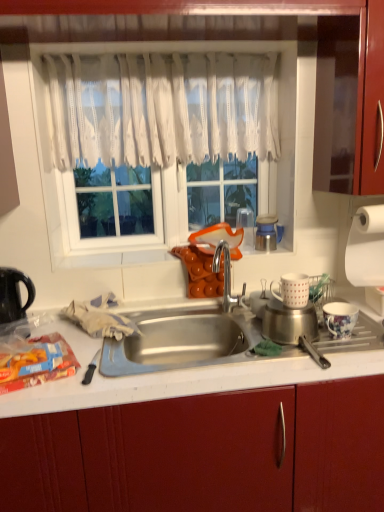
What do you see at coordinates (110, 259) in the screenshot? I see `orange matte cups at center` at bounding box center [110, 259].

Measure the distance between transparent plastic cup at upper center, the fifth appliance positioned from the right, and camera.

transparent plastic cup at upper center, the fifth appliance positioned from the right, is 1.92 meters from camera.

In order to face transparent plastic cup at upper center, the first appliance positioned from the left, should I rotate leftwards or rightwards?

Turn right by 7.497 degrees to look at transparent plastic cup at upper center, the first appliance positioned from the left.

Locate an element on the screen. This screenshot has height=512, width=384. black plastic kettle at left is located at coordinates (14, 294).

The image size is (384, 512). Describe the element at coordinates (340, 318) in the screenshot. I see `porcelain floral cup at right, marked as the second appliance in a right-to-left arrangement` at that location.

Find the location of a particular element. The height and width of the screenshot is (512, 384). white paper towel at upper right, arranged as the fifth appliance when viewed from the left is located at coordinates (367, 254).

In the scene shown: In order to face white lace curtain at upper center, should I rotate leftwards or rightwards?

You should look left and rotate roughly 3.071 degrees.

At what (x,y) coordinates should I click in order to perform the action: click on orange matte cups at center. Please return your answer as a coordinate pair (x, y). The image size is (384, 512). Looking at the image, I should click on (x=110, y=259).

From the picture: Between orange matte cups at center and white lace curtain at upper center, which one has smaller size?

With smaller size is orange matte cups at center.

Is orange matte cups at center to the left of white lace curtain at upper center from the viewer's perspective?

In fact, orange matte cups at center is to the right of white lace curtain at upper center.

Who is more distant, orange matte cups at center or white lace curtain at upper center?

orange matte cups at center is further from the camera.

From a real-world perspective, between orange matte cups at center and white lace curtain at upper center, who is vertically higher?

white lace curtain at upper center.

In terms of width, does transparent plastic cup at upper center, the fifth appliance positioned from the right, look wider or thinner when compared to white paper towel at upper right, arranged as the fifth appliance when viewed from the left?

transparent plastic cup at upper center, the fifth appliance positioned from the right, is thinner than white paper towel at upper right, arranged as the fifth appliance when viewed from the left.

Is point (252, 219) in front of point (380, 274)?

No, (252, 219) is further to viewer.

Considering the sizes of transparent plastic cup at upper center, the fifth appliance positioned from the right, and white paper towel at upper right, arranged as the fifth appliance when viewed from the left, in the image, is transparent plastic cup at upper center, the fifth appliance positioned from the right, taller or shorter than white paper towel at upper right, arranged as the fifth appliance when viewed from the left,?

In the image, transparent plastic cup at upper center, the fifth appliance positioned from the right, appears to be shorter than white paper towel at upper right, arranged as the fifth appliance when viewed from the left.

From the image's perspective, does transparent plastic cup at upper center, the fifth appliance positioned from the right, appear lower than white paper towel at upper right, arranged as the fifth appliance when viewed from the left?

Actually, transparent plastic cup at upper center, the fifth appliance positioned from the right, appears above white paper towel at upper right, arranged as the fifth appliance when viewed from the left, in the image.

How much distance is there between white paper towel at upper right, acting as the 1th appliance starting from the right, and transparent plastic cup at upper center, the first appliance positioned from the left?

19.55 inches.

Which object is closer to the camera, white paper towel at upper right, acting as the 1th appliance starting from the right, or transparent plastic cup at upper center, the first appliance positioned from the left?

Positioned in front is white paper towel at upper right, acting as the 1th appliance starting from the right.

In the scene shown: From a real-world perspective, between white paper towel at upper right, arranged as the fifth appliance when viewed from the left, and transparent plastic cup at upper center, the fifth appliance positioned from the right, who is vertically lower?

white paper towel at upper right, arranged as the fifth appliance when viewed from the left, is physically lower.

From the image's perspective, is white paper towel at upper right, arranged as the fifth appliance when viewed from the left, beneath transparent plastic cup at upper center, the fifth appliance positioned from the right?

Correct, white paper towel at upper right, arranged as the fifth appliance when viewed from the left, appears lower than transparent plastic cup at upper center, the fifth appliance positioned from the right, in the image.

From the image's perspective, which one is positioned higher, white paper towel at upper right, acting as the 1th appliance starting from the right, or white lace curtain at upper center?

white lace curtain at upper center is shown above in the image.

Considering the relative sizes of white paper towel at upper right, acting as the 1th appliance starting from the right, and white lace curtain at upper center in the image provided, is white paper towel at upper right, acting as the 1th appliance starting from the right, bigger than white lace curtain at upper center?

No, white paper towel at upper right, acting as the 1th appliance starting from the right, is not bigger than white lace curtain at upper center.

Considering the positions of objects white paper towel at upper right, arranged as the fifth appliance when viewed from the left, and white lace curtain at upper center in the image provided, who is more to the left, white paper towel at upper right, arranged as the fifth appliance when viewed from the left, or white lace curtain at upper center?

white lace curtain at upper center.

Is there a large distance between white matte mug at right, which is the fourth appliance from right to left, and white lace curtain at upper center?

That's not correct — white matte mug at right, which is the fourth appliance from right to left, is a little close to white lace curtain at upper center.

Is white matte mug at right, the second appliance in the left-to-right sequence, thinner than white lace curtain at upper center?

No.

Can you confirm if white matte mug at right, the second appliance in the left-to-right sequence, is positioned to the left of white lace curtain at upper center?

No.

From the image's perspective, is white matte mug at right, the second appliance in the left-to-right sequence, over white lace curtain at upper center?

No, from the image's perspective, white matte mug at right, the second appliance in the left-to-right sequence, is not above white lace curtain at upper center.

Would you consider black plastic kettle at left to be distant from metallic blue thermos at upper right, which is the 3th appliance in right-to-left order?

black plastic kettle at left is far away from metallic blue thermos at upper right, which is the 3th appliance in right-to-left order.

In the scene shown: From the image's perspective, is black plastic kettle at left located above metallic blue thermos at upper right, the third appliance when ordered from left to right?

No, from the image's perspective, black plastic kettle at left is not above metallic blue thermos at upper right, the third appliance when ordered from left to right.

Is black plastic kettle at left wider or thinner than metallic blue thermos at upper right, which is the 3th appliance in right-to-left order?

Clearly, black plastic kettle at left has more width compared to metallic blue thermos at upper right, which is the 3th appliance in right-to-left order.

In the image, there is a metallic blue thermos at upper right, which is the 3th appliance in right-to-left order. In order to click on kitchen appliance below it (from a real-world perspective) in this screenshot , I will do `click(14, 294)`.

Does metallic blue thermos at upper right, the third appliance when ordered from left to right, come in front of white matte mug at right, which is the fourth appliance from right to left?

That is False.

From the image's perspective, would you say metallic blue thermos at upper right, which is the 3th appliance in right-to-left order, is shown under white matte mug at right, which is the fourth appliance from right to left?

Actually, metallic blue thermos at upper right, which is the 3th appliance in right-to-left order, appears above white matte mug at right, which is the fourth appliance from right to left, in the image.

In terms of height, does metallic blue thermos at upper right, the third appliance when ordered from left to right, look taller or shorter compared to white matte mug at right, the second appliance in the left-to-right sequence?

In the image, metallic blue thermos at upper right, the third appliance when ordered from left to right, appears to be taller than white matte mug at right, the second appliance in the left-to-right sequence.

Find the location of a particular element. curtain that appears in front of the orange matte cups at center is located at coordinates (162, 108).

The width and height of the screenshot is (384, 512). Identify the location of the 1st appliance behind the white paper towel at upper right, arranged as the fifth appliance when viewed from the left. (246, 226).

Estimate the real-world distances between objects in this image. Which object is further from white lace curtain at upper center, white paper towel at upper right, acting as the 1th appliance starting from the right, or transparent plastic cup at upper center, the first appliance positioned from the left?

white paper towel at upper right, acting as the 1th appliance starting from the right.

From the image, which object appears to be farther from porcelain floral cup at right, which ranks as the fourth appliance in left-to-right order, white matte mug at right, the second appliance in the left-to-right sequence, or white paper towel at upper right, acting as the 1th appliance starting from the right?

white paper towel at upper right, acting as the 1th appliance starting from the right, is positioned further to the anchor porcelain floral cup at right, which ranks as the fourth appliance in left-to-right order.

Considering their positions, is white lace curtain at upper center positioned further to white paper towel at upper right, arranged as the fifth appliance when viewed from the left, than transparent plastic cup at upper center, the fifth appliance positioned from the right?

Based on the image, white lace curtain at upper center appears to be further to white paper towel at upper right, arranged as the fifth appliance when viewed from the left.

From the image, which object appears to be nearer to white matte mug at right, which is the fourth appliance from right to left, transparent plastic cup at upper center, the fifth appliance positioned from the right, or orange matte cups at center?

transparent plastic cup at upper center, the fifth appliance positioned from the right, is closer to white matte mug at right, which is the fourth appliance from right to left.

Estimate the real-world distances between objects in this image. Which object is further from white lace curtain at upper center, white matte mug at right, the second appliance in the left-to-right sequence, or metallic blue thermos at upper right, which is the 3th appliance in right-to-left order?

Among the two, white matte mug at right, the second appliance in the left-to-right sequence, is located further to white lace curtain at upper center.

Based on the photo, from the image, which object appears to be farther from white matte mug at right, the second appliance in the left-to-right sequence, white lace curtain at upper center or transparent plastic cup at upper center, the fifth appliance positioned from the right?

white lace curtain at upper center lies further to white matte mug at right, the second appliance in the left-to-right sequence, than the other object.

Considering their positions, is white paper towel at upper right, arranged as the fifth appliance when viewed from the left, positioned closer to white matte mug at right, the second appliance in the left-to-right sequence, than porcelain floral cup at right, marked as the second appliance in a right-to-left arrangement?

The object closer to white matte mug at right, the second appliance in the left-to-right sequence, is porcelain floral cup at right, marked as the second appliance in a right-to-left arrangement.

Looking at the image, which one is located further to black plastic kettle at left, metallic blue thermos at upper right, the third appliance when ordered from left to right, or white lace curtain at upper center?

metallic blue thermos at upper right, the third appliance when ordered from left to right, is positioned further to the anchor black plastic kettle at left.

This screenshot has width=384, height=512. I want to click on window sill between white lace curtain at upper center and white paper towel at upper right, acting as the 1th appliance starting from the right, in the horizontal direction, so click(x=110, y=259).

Find the location of a particular element. This screenshot has height=512, width=384. curtain between black plastic kettle at left and white paper towel at upper right, arranged as the fifth appliance when viewed from the left is located at coordinates (162, 108).

I want to click on window sill between white lace curtain at upper center and white matte mug at right, which is the fourth appliance from right to left, from top to bottom, so point(110,259).

I want to click on window sill between translucent plastic bag of frozen vegetables at lower left and porcelain floral cup at right, which ranks as the fourth appliance in left-to-right order, in the horizontal direction, so click(110, 259).